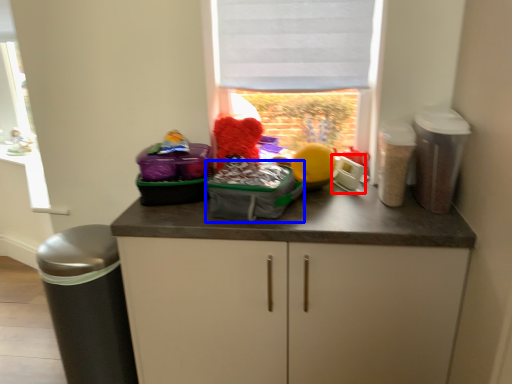
Question: Which point is further to the camera, appliance (highlighted by a red box) or kit (highlighted by a blue box)?

Choices:
 (A) appliance
 (B) kit

Answer: (A)